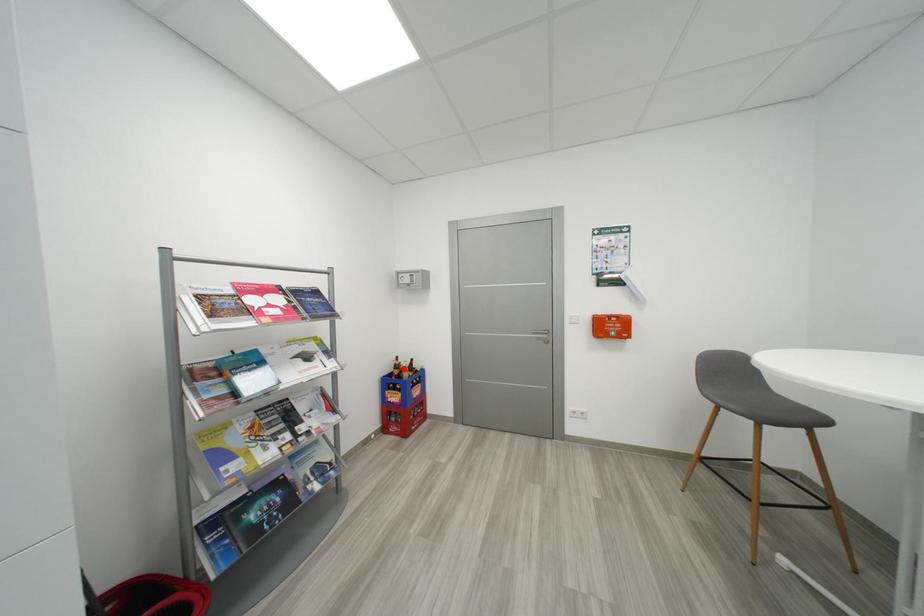
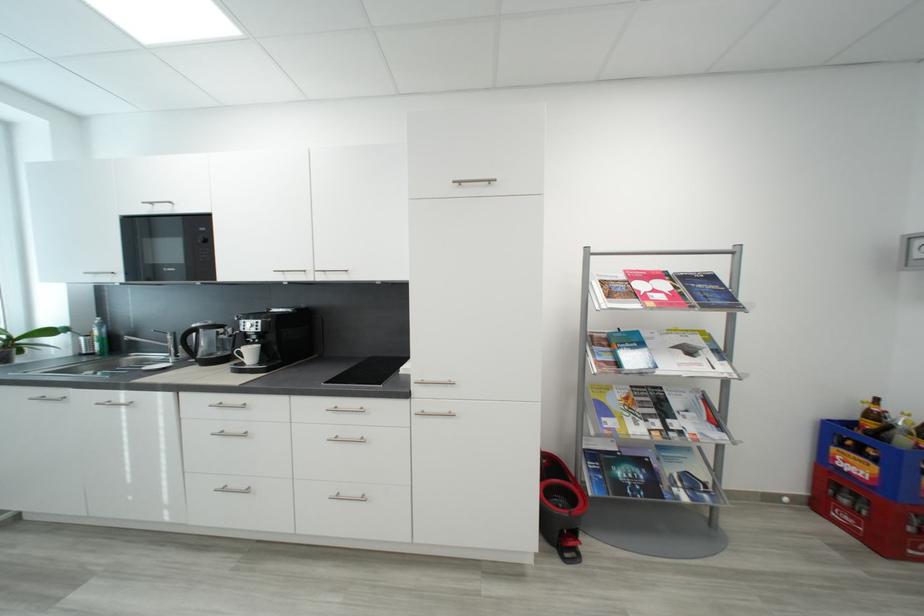
Question: I am providing you with two images of the same scene from different viewpoints. Image1 has a red point marked. In image2, the corresponding 3D location appears at what relative position? Reply with the corresponding letter.

Choices:
 (A) Closer
 (B) Farther

Answer: (A)